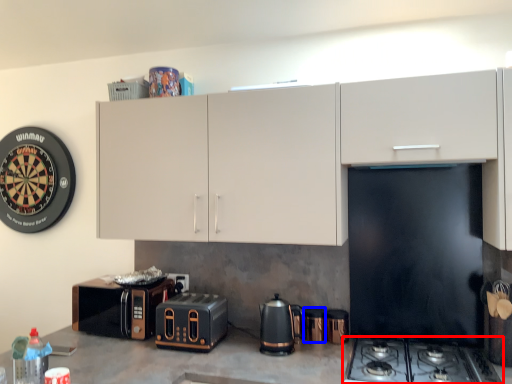
Question: Which object appears farthest to the camera in this image, gas stove (highlighted by a red box) or appliance (highlighted by a blue box)?

Choices:
 (A) gas stove
 (B) appliance

Answer: (B)